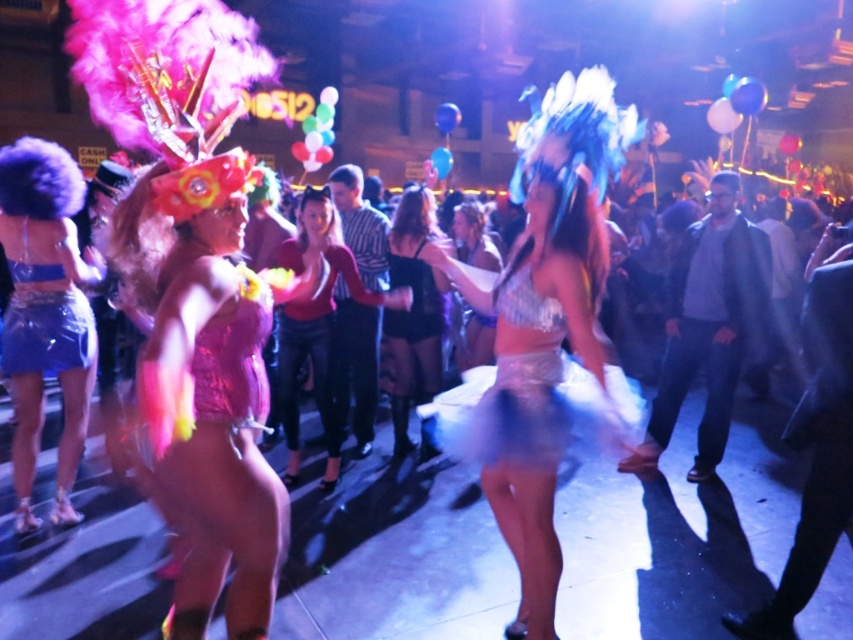
Question: Which point is closer to the camera?

Choices:
 (A) shiny blue sequin skirt at lower left
 (B) black sequined dress at center

Answer: (A)

Question: Can you confirm if shiny blue sequin skirt at lower left is bigger than shiny silver skirt at center?

Choices:
 (A) yes
 (B) no

Answer: (A)

Question: Is shiny silver dress at center to the right of black sequined dress at center from the viewer's perspective?

Choices:
 (A) no
 (B) yes

Answer: (B)

Question: Does shiny blue sequin skirt at lower left appear on the right side of white sequined dress at center?

Choices:
 (A) yes
 (B) no

Answer: (B)

Question: Estimate the real-world distances between objects in this image. Which object is farther from the shiny silver dress at center?

Choices:
 (A) shiny pink sequin dress at center
 (B) matte red blouse at center

Answer: (B)

Question: Which object appears farthest from the camera in this image?

Choices:
 (A) black satin dress at center
 (B) shiny silver skirt at center
 (C) matte red blouse at center

Answer: (B)